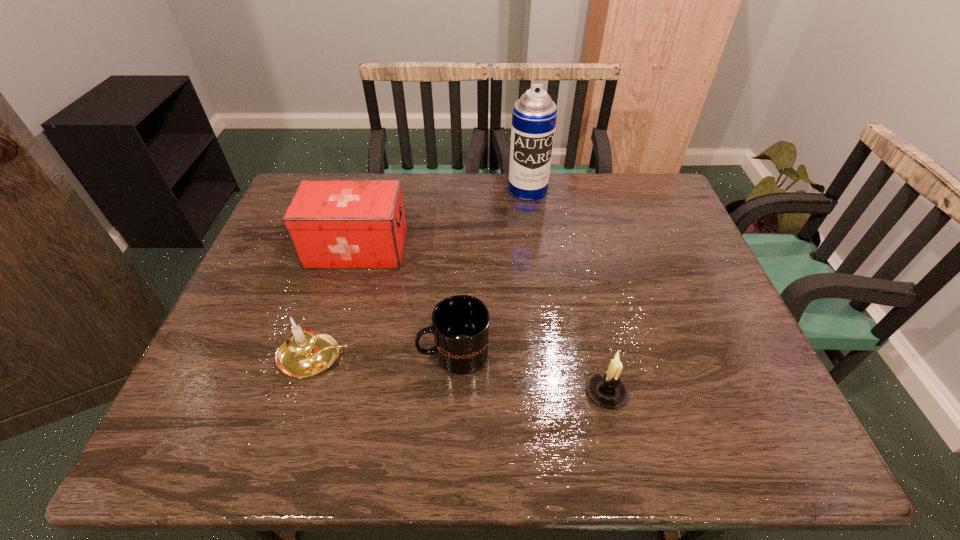
Locate an element on the screen. This screenshot has height=540, width=960. free location that satisfies the following two spatial constraints: 1. on the label side of the tallest object; 2. on the handle side of the first-aid kit is located at coordinates (536, 249).

In order to click on free space that satisfies the following two spatial constraints: 1. on the label side of the second object from right to left; 2. with the handle on the side of the third object from left to right in this screenshot , I will do `click(549, 353)`.

Where is `free space that satisfies the following two spatial constraints: 1. on the handle side of the rightmost object; 2. on the left side of the second farthest object`? free space that satisfies the following two spatial constraints: 1. on the handle side of the rightmost object; 2. on the left side of the second farthest object is located at coordinates (316, 392).